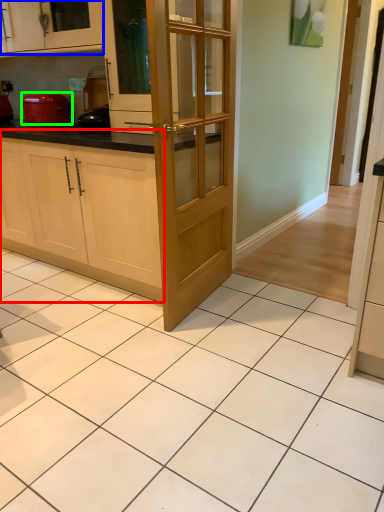
Question: Estimate the real-world distances between objects in this image. Which object is farther from cabinetry (highlighted by a red box), cabinetry (highlighted by a blue box) or kitchen appliance (highlighted by a green box)?

Choices:
 (A) cabinetry
 (B) kitchen appliance

Answer: (A)